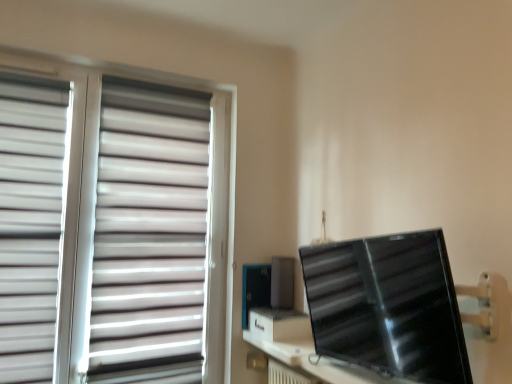
The image size is (512, 384). What are the coordinates of `empty space that is ontop of white matte blinds at left, which is the 2th curtain in left-to-right order (from a real-world perspective)` in the screenshot? It's located at (159, 79).